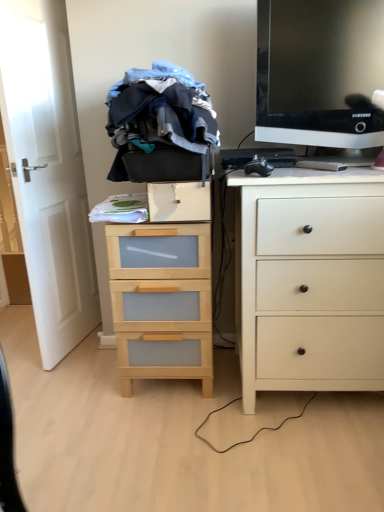
Locate an element on the screen. free space to the left of white matte chest of drawers at right, which is counted as the 2th chest of drawers, starting from the left is located at coordinates (182, 431).